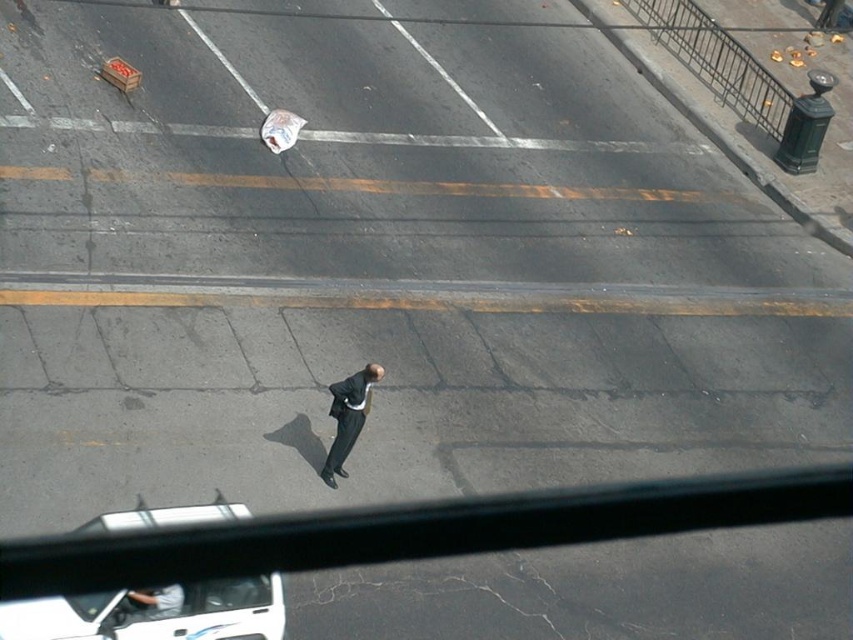
You are a passenger in the vehicle and want to point out the dark gray suit at center to the driver. Which side of the white glossy car at lower left should you indicate to locate it?

The dark gray suit at center is to the right of the white glossy car at lower left, so you should indicate the right side of the white glossy car at lower left to locate it.

You are a passenger in the car and want to get out to talk to the man in the dark gray suit at center. Is the white glossy car at lower left blocking your exit?

The white glossy car at lower left is positioned under dark gray suit at center, so the car is not directly blocking the exit path to the man in the dark gray suit at center. You should be able to exit safely.